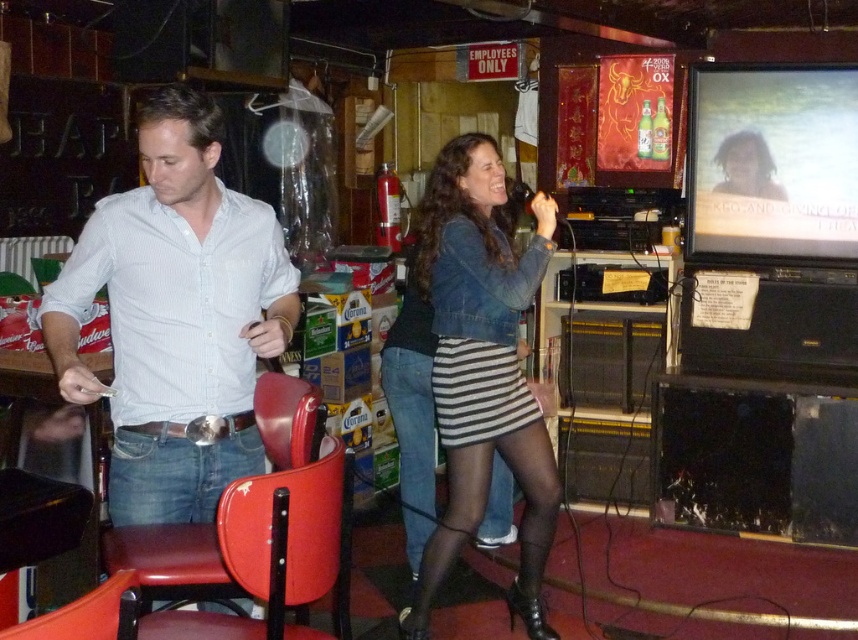
Where is `matte red chair at center`? matte red chair at center is located at coordinates (287, 419).

Who is more forward, (287, 460) or (80, 600)?

Point (80, 600)

In the scene shown: Who is more distant from viewer, (319,396) or (88,624)?

The point (319,396) is more distant.

Where is `matte red chair at center`? matte red chair at center is located at coordinates (287, 419).

Is white striped shirt at left above white shirt at left?

Indeed, white striped shirt at left is positioned over white shirt at left.

Which is more to the right, white striped shirt at left or white shirt at left?

white striped shirt at left is more to the right.

This screenshot has height=640, width=858. What do you see at coordinates (174, 316) in the screenshot?
I see `white striped shirt at left` at bounding box center [174, 316].

Where is `white striped shirt at left`? This screenshot has height=640, width=858. white striped shirt at left is located at coordinates (174, 316).

Looking at this image, between red leather chair at center and matte red chair at center, which one has more height?

red leather chair at center

Locate an element on the screen. The image size is (858, 640). red leather chair at center is located at coordinates (257, 534).

Locate an element on the screen. The image size is (858, 640). red leather chair at center is located at coordinates (257, 534).